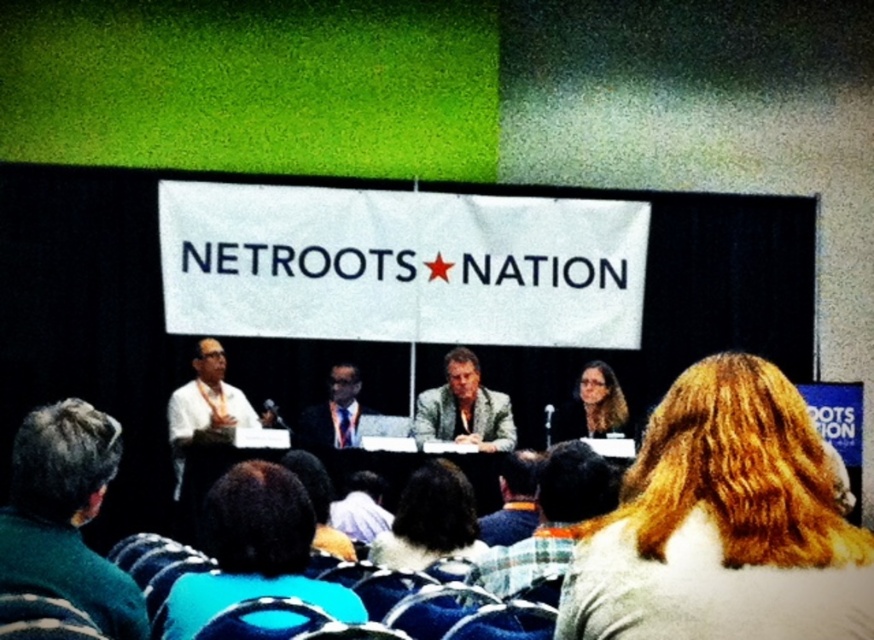
Is blonde hair at center bigger than dark green sweater at lower left?

Yes.

Does blonde hair at center come in front of dark green sweater at lower left?

Yes, it is.

Locate an element on the screen. Image resolution: width=874 pixels, height=640 pixels. blonde hair at center is located at coordinates (723, 524).

I want to click on blonde hair at center, so click(x=723, y=524).

In order to click on dark brown hair at center in this screenshot , I will do `click(429, 520)`.

Who is more distant from viewer, (459, 556) or (592, 433)?

Positioned behind is point (592, 433).

Where is `dark brown hair at center`? This screenshot has height=640, width=874. dark brown hair at center is located at coordinates (429, 520).

Is point (512, 564) less distant than point (400, 504)?

Yes, point (512, 564) is closer to viewer.

Which is more to the left, plaid shirt at center or dark brown hair at center?

dark brown hair at center

Who is more forward, (505, 568) or (410, 538)?

Positioned in front is point (505, 568).

You are a GUI agent. You are given a task and a screenshot of the screen. Output one action in this format:
    pyautogui.click(x=<x>, y=<y>)
    Task: Click on the plaid shirt at center
    This screenshot has width=874, height=640.
    Given the screenshot: What is the action you would take?
    pyautogui.click(x=551, y=518)